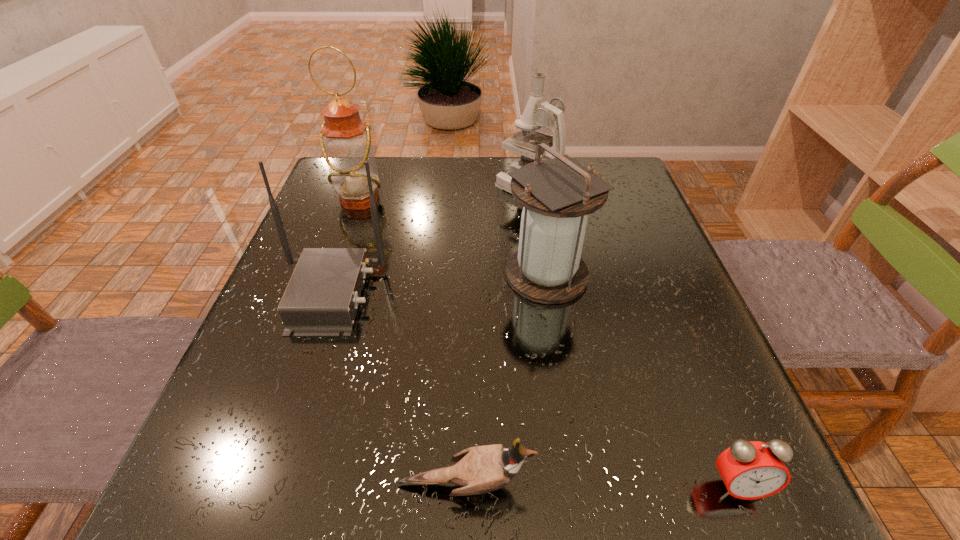
What are the coordinates of `free space between the rightmost object and the microscope` in the screenshot? It's located at (633, 337).

You are a GUI agent. You are given a task and a screenshot of the screen. Output one action in this format:
    pyautogui.click(x=<x>, y=<y>)
    Task: Click on the free space between the alarm clock and the router
    
    Given the screenshot: What is the action you would take?
    pyautogui.click(x=534, y=390)

Locate an element on the screen. This screenshot has width=960, height=540. vacant area that lies between the microscope and the tallest object is located at coordinates tap(444, 194).

At what (x,y) coordinates should I click in order to perform the action: click on empty location between the bird and the router. Please return your answer as a coordinate pair (x, y). This screenshot has height=540, width=960. Looking at the image, I should click on (397, 389).

You are a GUI agent. You are given a task and a screenshot of the screen. Output one action in this format:
    pyautogui.click(x=<x>, y=<y>)
    Task: Click on the free space between the lantern and the rightmost object
    This screenshot has width=960, height=540.
    Given the screenshot: What is the action you would take?
    pyautogui.click(x=641, y=380)

The height and width of the screenshot is (540, 960). I want to click on unoccupied position between the microscope and the bird, so click(x=497, y=336).

This screenshot has height=540, width=960. I want to click on vacant region between the oil lamp and the bird, so click(412, 342).

The image size is (960, 540). What are the coordinates of `object that can be found as the fifth closest to the lantern` in the screenshot? It's located at (750, 470).

Identify which object is the fourth closest to the second shortest object. Please provide its 2D coordinates. Your answer should be formatted as a tuple, i.e. [(x, y)], where the tuple contains the x and y coordinates of a point satisfying the conditions above.

[(345, 139)]

The image size is (960, 540). Find the location of `free space that satisfies the following two spatial constraints: 1. on the back side of the tallest object; 2. on the left side of the microscope`. free space that satisfies the following two spatial constraints: 1. on the back side of the tallest object; 2. on the left side of the microscope is located at coordinates (364, 188).